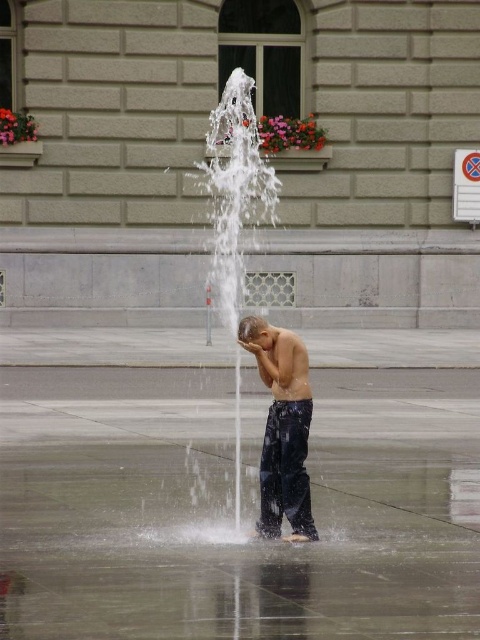
You are a photographer standing at the edge of the square. You want to capture a photo where both the white frothy water at center and the dark blue jeans at center are in focus. Given that your camera can focus on objects within a 2.5 meter range, will you be able to achieve this?

The white frothy water at center and dark blue jeans at center are 3.24 meters apart. Since the distance between them exceeds the camera focus range of 2.5 meters, you won not be able to capture both in focus simultaneously.

You are a photographer standing in the public square. You want to capture a photo where the white frothy water at center and dark blue jeans at center are both clearly visible. Which object should you focus on to ensure both are in focus?

You should focus on the dark blue jeans at center because it is closer to you than the white frothy water at center, which is further away. By focusing on the closer object, the depth of field may allow both to be in focus.